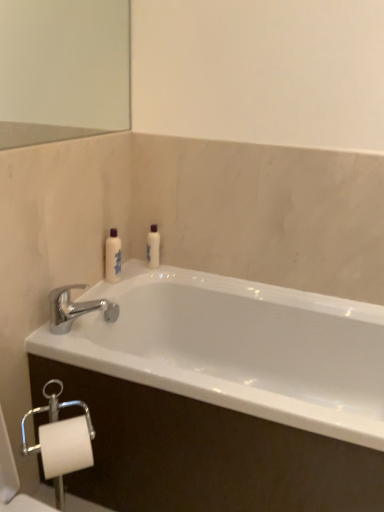
Question: Is white glossy lotion at center, the 1th toiletry viewed from the right, wider than white glossy bottle at upper left, placed as the 2th toiletry when sorted from right to left?

Choices:
 (A) yes
 (B) no

Answer: (B)

Question: Can you confirm if white glossy lotion at center, the 2th toiletry from the front, is shorter than white glossy bottle at upper left, placed as the 2th toiletry when sorted from right to left?

Choices:
 (A) yes
 (B) no

Answer: (A)

Question: Does white glossy lotion at center, positioned as the 2th toiletry in left-to-right order, appear on the right side of white glossy bottle at upper left, which is counted as the first toiletry, starting from the front?

Choices:
 (A) no
 (B) yes

Answer: (B)

Question: Could you tell me if white glossy lotion at center, the 1th toiletry viewed from the right, is facing white glossy bottle at upper left, which ranks as the 1th toiletry in left-to-right order?

Choices:
 (A) no
 (B) yes

Answer: (A)

Question: Is white glossy lotion at center, the 2th toiletry from the front, positioned beyond the bounds of white glossy bottle at upper left, placed as the 2th toiletry when sorted from right to left?

Choices:
 (A) no
 (B) yes

Answer: (B)

Question: Considering the positions of white glossy bottle at upper left, which ranks as the 1th toiletry in left-to-right order, and white glossy lotion at center, positioned as the 2th toiletry in left-to-right order, in the image, is white glossy bottle at upper left, which ranks as the 1th toiletry in left-to-right order, taller or shorter than white glossy lotion at center, positioned as the 2th toiletry in left-to-right order,?

Choices:
 (A) short
 (B) tall

Answer: (B)

Question: Looking at their shapes, would you say white glossy bottle at upper left, the second toiletry when ordered from back to front, is wider or thinner than white glossy lotion at center, the 2th toiletry from the front?

Choices:
 (A) thin
 (B) wide

Answer: (B)

Question: Considering their positions, is white glossy bottle at upper left, which is counted as the first toiletry, starting from the front, located in front of or behind white glossy lotion at center, positioned as the 2th toiletry in left-to-right order?

Choices:
 (A) front
 (B) behind

Answer: (A)

Question: Would you say white glossy bottle at upper left, which is counted as the first toiletry, starting from the front, is inside or outside white glossy lotion at center, the first toiletry positioned from the back?

Choices:
 (A) inside
 (B) outside

Answer: (B)

Question: From the image's perspective, is white glossy lotion at center, positioned as the 2th toiletry in left-to-right order, above or below chrome metallic faucet at upper left?

Choices:
 (A) above
 (B) below

Answer: (A)

Question: Is point (157, 258) closer or farther from the camera than point (115, 317)?

Choices:
 (A) farther
 (B) closer

Answer: (B)

Question: From a real-world perspective, is white glossy lotion at center, positioned as the 2th toiletry in left-to-right order, above or below chrome metallic faucet at upper left?

Choices:
 (A) below
 (B) above

Answer: (B)

Question: Would you say white glossy lotion at center, the first toiletry positioned from the back, is to the left or to the right of chrome metallic faucet at upper left in the picture?

Choices:
 (A) right
 (B) left

Answer: (A)

Question: From the image's perspective, is white glossy bottle at upper left, placed as the 2th toiletry when sorted from right to left, positioned above or below chrome metallic faucet at upper left?

Choices:
 (A) below
 (B) above

Answer: (B)

Question: Is white glossy bottle at upper left, placed as the 2th toiletry when sorted from right to left, wider or thinner than chrome metallic faucet at upper left?

Choices:
 (A) thin
 (B) wide

Answer: (A)